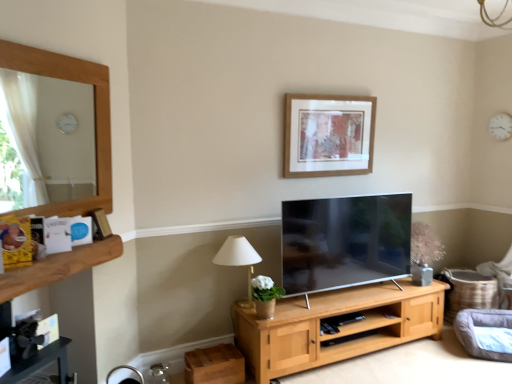
Where is `vacant area on top of brown wooden shelf at left (from a real-world perspective)`? This screenshot has width=512, height=384. vacant area on top of brown wooden shelf at left (from a real-world perspective) is located at coordinates (70, 248).